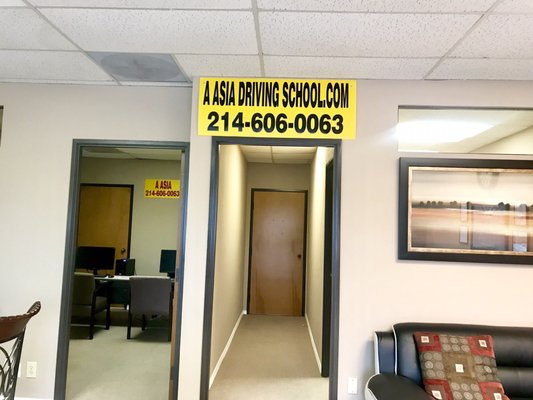
The image size is (533, 400). I want to click on picture, so click(453, 190).